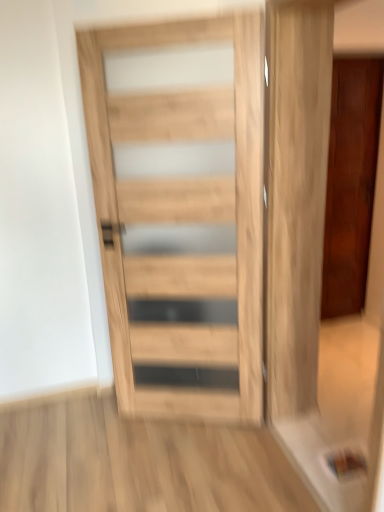
Identify the location of empty space that is ontop of natural wood door at center, the first door in the left-to-right sequence (from a real-world perspective). This screenshot has width=384, height=512. (190, 16).